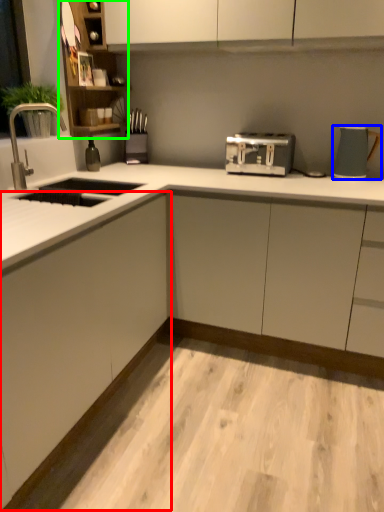
Question: Which object is the closest to the cabinetry (highlighted by a red box)? Choose among these: kitchen appliance (highlighted by a blue box) or cabinet (highlighted by a green box).

Choices:
 (A) kitchen appliance
 (B) cabinet

Answer: (B)